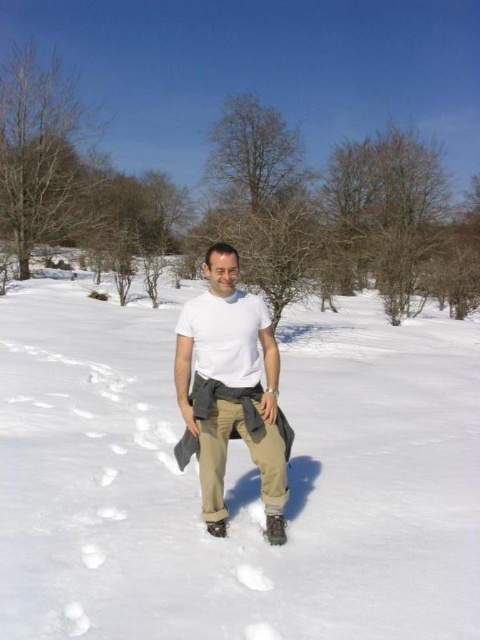
You are a photographer trying to capture a clear shot of the white fluffy snow at center and the white matte shirt at center. Which object will appear larger in your photo?

The white fluffy snow at center will appear larger in the photo because it is closer to the viewer than the white matte shirt at center.

You are a photographer planning to take a photo of the white fluffy snow at center and the white matte shirt at center. Since both are white, how can you distinguish them in the final image?

The white fluffy snow at center is located below the white matte shirt at center, so in the photo, the snow will appear beneath the shirt, making them distinguishable based on their positions.